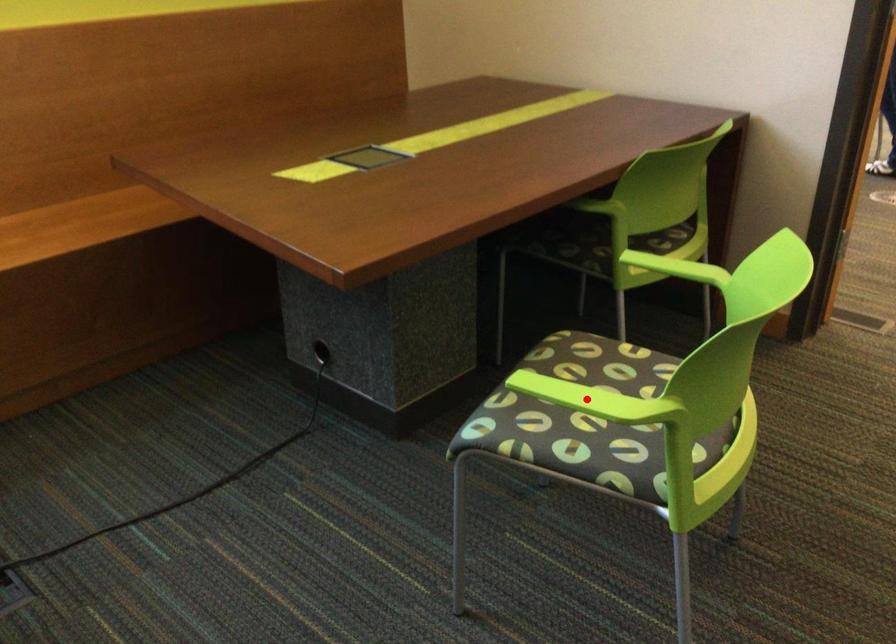
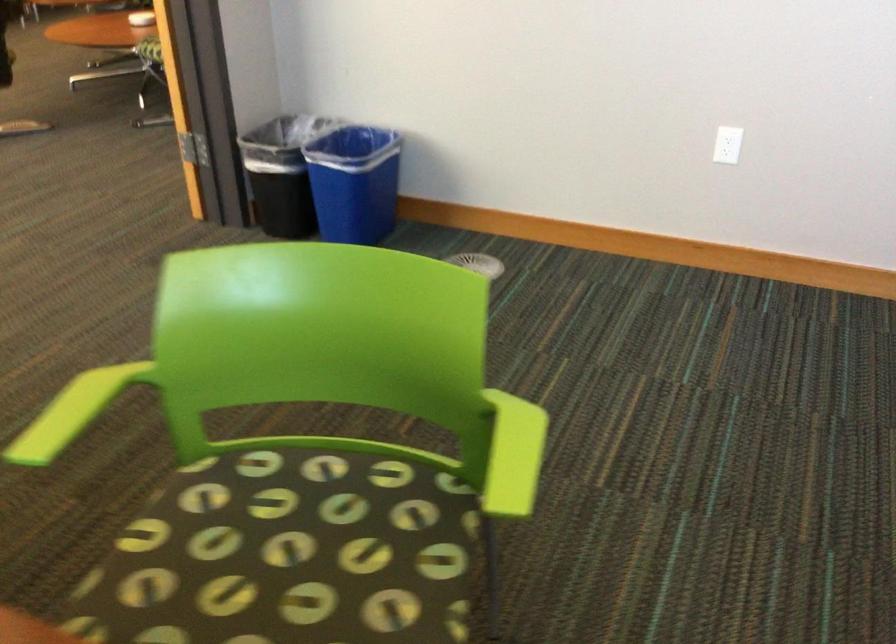
Question: I am providing you with two images of the same scene from different viewpoints. In image1, a red point is highlighted. Considering the same 3D point in image2, which of the following is correct?

Choices:
 (A) It is closer
 (B) It is farther

Answer: (A)